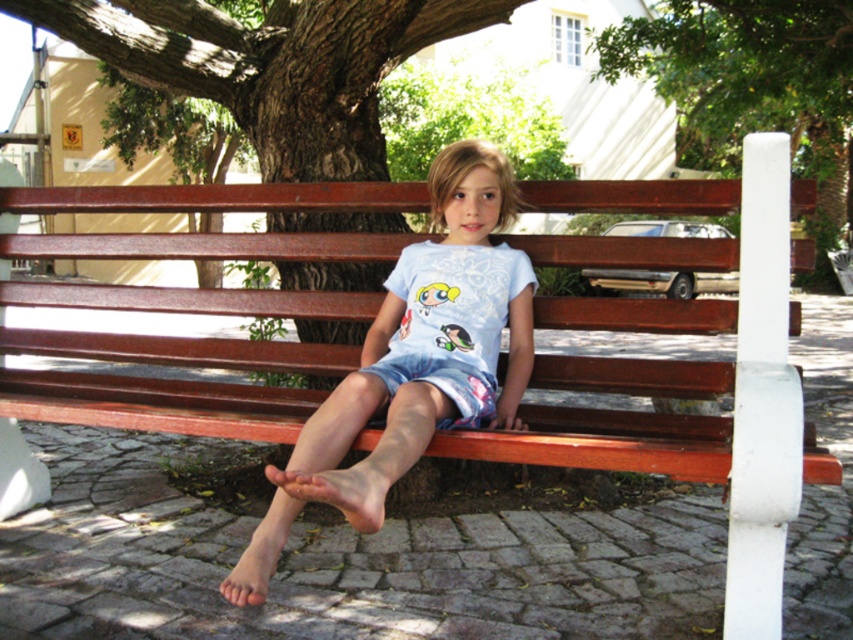
Question: Which object is closer to the camera taking this photo?

Choices:
 (A) light blue cotton shirt at center
 (B) green leafy tree at upper center

Answer: (A)

Question: Considering the relative positions of light blue cotton shirt at center and green leafy tree at upper center in the image provided, where is light blue cotton shirt at center located with respect to green leafy tree at upper center?

Choices:
 (A) above
 (B) below

Answer: (B)

Question: Does light blue cotton shirt at center have a lesser width compared to green leafy tree at upper center?

Choices:
 (A) no
 (B) yes

Answer: (B)

Question: Which point is farther to the camera?

Choices:
 (A) (432, 358)
 (B) (821, 266)

Answer: (B)

Question: Can you confirm if light blue cotton shirt at center is thinner than green leafy tree at upper center?

Choices:
 (A) no
 (B) yes

Answer: (B)